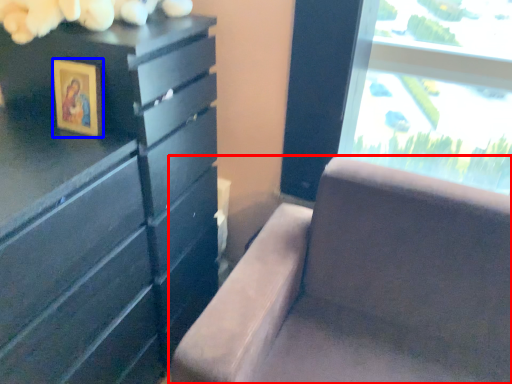
Question: Which object appears closest to the camera in this image, furniture (highlighted by a red box) or picture frame (highlighted by a blue box)?

Choices:
 (A) furniture
 (B) picture frame

Answer: (A)